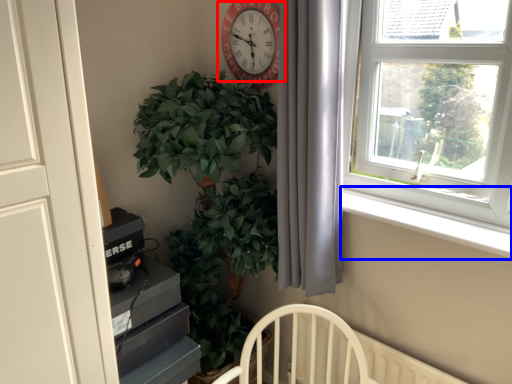
Question: Which object appears farthest to the camera in this image, wall clock (highlighted by a red box) or window sill (highlighted by a blue box)?

Choices:
 (A) wall clock
 (B) window sill

Answer: (A)